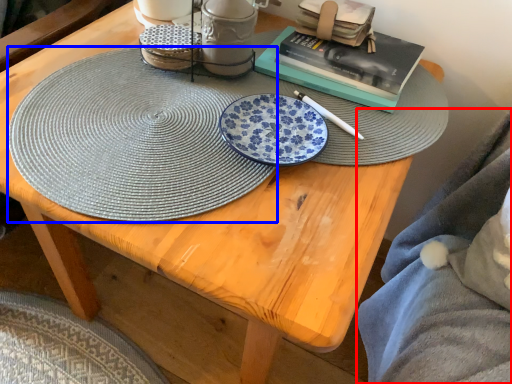
Question: Which point is closer to the camera, blanket (highlighted by a red box) or platter (highlighted by a blue box)?

Choices:
 (A) blanket
 (B) platter

Answer: (A)